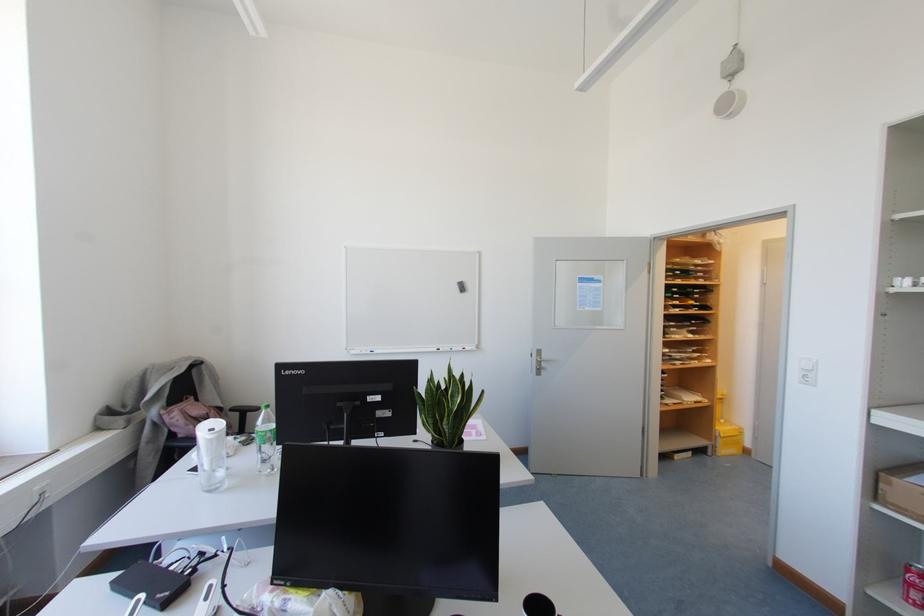
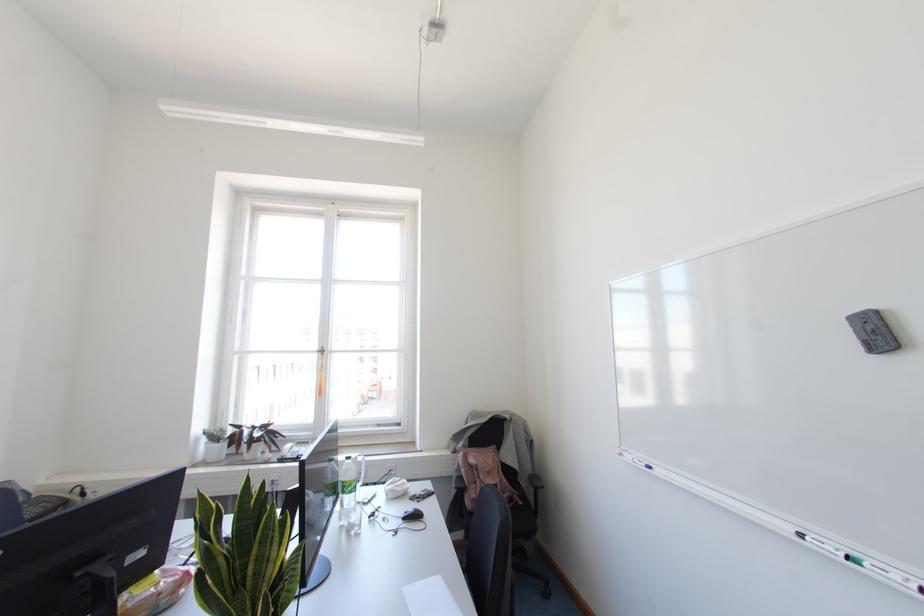
In the second image, find the point that corresponds to point (371, 351) in the first image.

(649, 467)